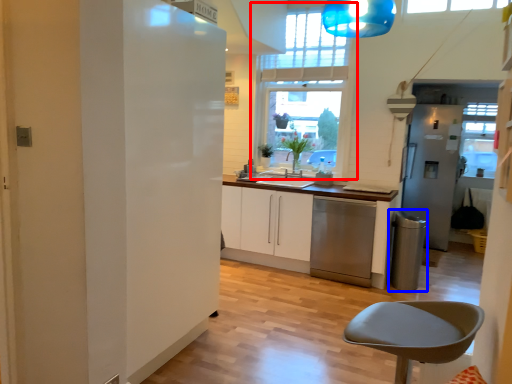
Question: Which of the following is the closest to the observer, window (highlighted by a red box) or appliance (highlighted by a blue box)?

Choices:
 (A) window
 (B) appliance

Answer: (B)